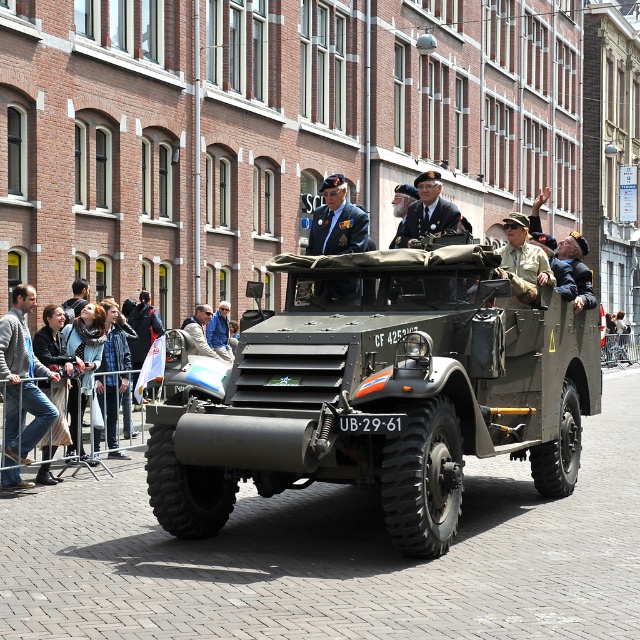
You are a photographer positioned at the side of the street during the parade. You want to capture a photo of the light blue denim jacket at center and the matte green military vehicle at center in a way that both are clearly visible. Based on their positions, which object should be placed on the left side of the photo frame?

The light blue denim jacket at center should be placed on the left side of the photo frame because the matte green military vehicle at center is to the right of it.

You are a spectator standing at the center of the street during the parade. You notice two points marked on the armored car. The first point is at coordinate point (280, 385) and the second is at point (227, 340). From your perspective, which point is closer to you?

Point (280, 385) is in front of point (227, 340), so it is closer to you as a spectator standing at the center of the street.